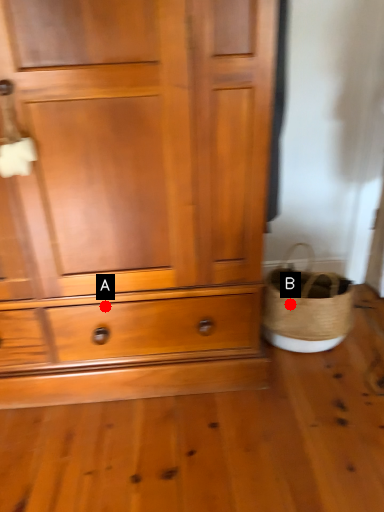
Question: Two points are circled on the image, labeled by A and B beside each circle. Which point is further to the camera?

Choices:
 (A) A is further
 (B) B is further

Answer: (B)